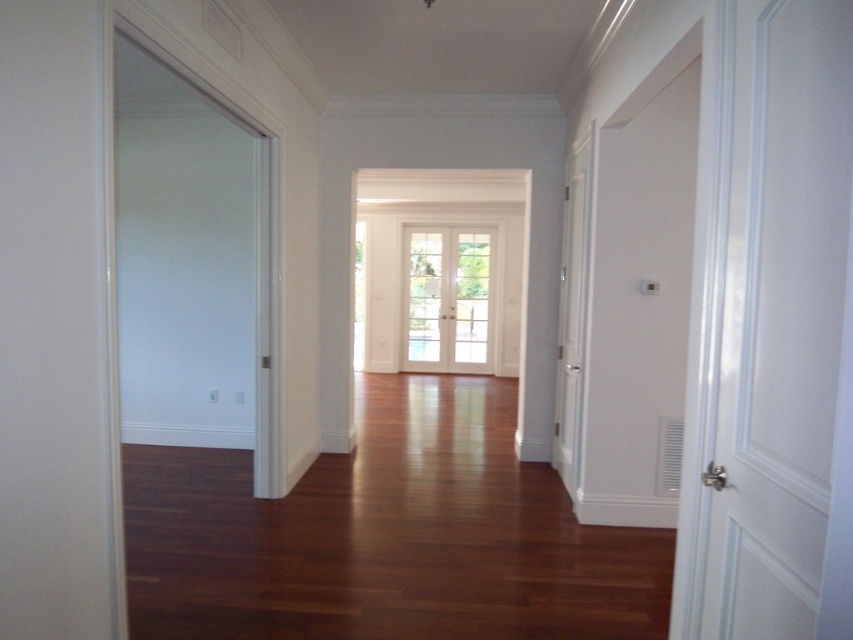
You are standing in the hallway and want to exit through the French doors. The white matte door at right is in your way. Can you walk around it to reach the French doors?

The white matte door at right is located at point (x=766, y=317), which means it is positioned near the end of the hallway. Since it is on the right side, you can walk around it by moving to the left side of the hallway to reach the French doors.

Looking at this image, you are a delivery person carrying a package that requires a 5 feet wide space to maneuver. You need to pass through the hallway and want to know if there is enough space between the white matte door at right and the white glossy door at upper right to turn around with the package. Can you fit?

The white matte door at right and white glossy door at upper right are 4.97 feet apart. Since the required space is 5 feet, you cannot fit between them to turn around with the package.

You are a delivery person carrying a tall package that is 2 meters in height. You need to pass through either the white matte door at right or the clear glass door at center. Which door should you choose to ensure the package can fit through without being too tall?

The clear glass door at center is taller than the white matte door at right. Since the package is 2 meters tall, you should choose the clear glass door at center to ensure it can fit through without being too tall.